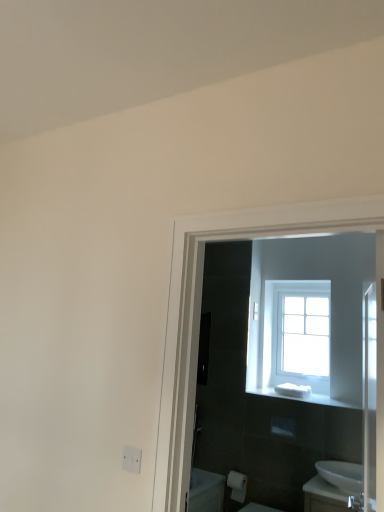
Image resolution: width=384 pixels, height=512 pixels. Describe the element at coordinates (302, 398) in the screenshot. I see `white plastic soap at center` at that location.

Locate an element on the screen. white plastic soap at center is located at coordinates (302, 398).

The width and height of the screenshot is (384, 512). Identify the location of clear glass window at upper center. (297, 334).

Looking at their sizes, would you say white matte electric outlet at lower left is wider or thinner than white plastic soap at center?

white matte electric outlet at lower left is thinner than white plastic soap at center.

Between white matte electric outlet at lower left and white plastic soap at center, which one is positioned behind?

white plastic soap at center is further away from the camera.

Is white matte electric outlet at lower left facing away from white plastic soap at center?

Yes, white matte electric outlet at lower left's orientation is away from white plastic soap at center.

Are white matte electric outlet at lower left and white plastic soap at center beside each other?

No, white matte electric outlet at lower left is not making contact with white plastic soap at center.

Could you tell me if white glossy sink at lower right is facing white plastic soap at center?

No, white glossy sink at lower right is not turned towards white plastic soap at center.

How much distance is there between white glossy sink at lower right and white plastic soap at center?

20.79 inches.

From a real-world perspective, is white glossy sink at lower right over white plastic soap at center?

Actually, white glossy sink at lower right is physically below white plastic soap at center in the real world.

Does white glossy sink at lower right appear on the right side of white plastic soap at center?

Yes, white glossy sink at lower right is to the right of white plastic soap at center.

How many degrees apart are the facing directions of white matte electric outlet at lower left and clear glass window at upper center?

0.937 degrees separate the facing orientations of white matte electric outlet at lower left and clear glass window at upper center.

Is white matte electric outlet at lower left far from clear glass window at upper center?

Yes, white matte electric outlet at lower left and clear glass window at upper center are quite far apart.

Relative to clear glass window at upper center, is white matte electric outlet at lower left in front or behind?

white matte electric outlet at lower left is positioned closer to the viewer than clear glass window at upper center.

Can you confirm if white glossy sink at lower right is smaller than white matte toilet paper at lower center?

No.

Considering the sizes of white glossy sink at lower right and white matte toilet paper at lower center in the image, is white glossy sink at lower right wider or thinner than white matte toilet paper at lower center?

Clearly, white glossy sink at lower right has more width compared to white matte toilet paper at lower center.

From a real-world perspective, does white glossy sink at lower right sit lower than white matte toilet paper at lower center?

No.

Could you tell me if white glossy sink at lower right is facing white matte toilet paper at lower center?

No, white glossy sink at lower right is not aimed at white matte toilet paper at lower center.

Is white matte toilet paper at lower center beside white glossy sink at lower right?

white matte toilet paper at lower center and white glossy sink at lower right are not in contact.

Is white matte toilet paper at lower center to the left of white glossy sink at lower right from the viewer's perspective?

Yes, white matte toilet paper at lower center is to the left of white glossy sink at lower right.

Which object is more forward, white matte toilet paper at lower center or white glossy sink at lower right?

white glossy sink at lower right.

Can you confirm if white matte toilet paper at lower center is thinner than white glossy sink at lower right?

Yes.

Could you tell me if white matte toilet paper at lower center is turned towards white plastic soap at center?

No, white matte toilet paper at lower center is not facing towards white plastic soap at center.

Based on the photo, from the image's perspective, would you say white matte toilet paper at lower center is shown under white plastic soap at center?

Indeed, from the image's perspective, white matte toilet paper at lower center is shown beneath white plastic soap at center.

From a real-world perspective, which is physically above, white matte toilet paper at lower center or white plastic soap at center?

white plastic soap at center, from a real-world perspective.

Considering the sizes of objects white matte toilet paper at lower center and white plastic soap at center in the image provided, who is taller, white matte toilet paper at lower center or white plastic soap at center?

white matte toilet paper at lower center.

Between white plastic soap at center and white matte toilet paper at lower center, which one has smaller width?

Thinner between the two is white matte toilet paper at lower center.

Considering the relative positions of white plastic soap at center and white matte toilet paper at lower center in the image provided, is white plastic soap at center to the left of white matte toilet paper at lower center from the viewer's perspective?

No, white plastic soap at center is not to the left of white matte toilet paper at lower center.

Does point (341, 404) appear closer or farther from the camera than point (235, 482)?

Point (341, 404) is closer to the camera than point (235, 482).

Locate an element on the screen. Image resolution: width=384 pixels, height=512 pixels. balustrade that appears below the white matte electric outlet at lower left (from the image's perspective) is located at coordinates (302, 398).

Image resolution: width=384 pixels, height=512 pixels. Identify the location of sink located underneath the white plastic soap at center (from a real-world perspective). (342, 475).

Considering their positions, is white matte toilet paper at lower center positioned further to white plastic soap at center than white matte electric outlet at lower left?

Among the two, white matte electric outlet at lower left is located further to white plastic soap at center.

When comparing their distances from white matte electric outlet at lower left, does clear glass window at upper center or white matte toilet paper at lower center seem closer?

white matte toilet paper at lower center lies closer to white matte electric outlet at lower left than the other object.

Looking at the image, which one is located further to white matte electric outlet at lower left, clear glass window at upper center or white plastic soap at center?

clear glass window at upper center.

Looking at the image, which one is located further to clear glass window at upper center, white matte toilet paper at lower center or white matte electric outlet at lower left?

white matte electric outlet at lower left is further to clear glass window at upper center.

When comparing their distances from white plastic soap at center, does white matte electric outlet at lower left or white matte toilet paper at lower center seem further?

white matte electric outlet at lower left lies further to white plastic soap at center than the other object.

Consider the image. From the image, which object appears to be farther from white matte electric outlet at lower left, white plastic soap at center or clear glass window at upper center?

clear glass window at upper center is positioned further to the anchor white matte electric outlet at lower left.

Estimate the real-world distances between objects in this image. Which object is further from white glossy sink at lower right, white plastic soap at center or clear glass window at upper center?

clear glass window at upper center is positioned further to the anchor white glossy sink at lower right.

Estimate the real-world distances between objects in this image. Which object is closer to white matte toilet paper at lower center, white glossy sink at lower right or white plastic soap at center?

white plastic soap at center is closer to white matte toilet paper at lower center.

The height and width of the screenshot is (512, 384). What are the coordinates of `toilet paper positioned between white matte electric outlet at lower left and clear glass window at upper center from near to far` in the screenshot? It's located at (237, 485).

Identify the location of balustrade between clear glass window at upper center and white matte toilet paper at lower center in the vertical direction. (302, 398).

This screenshot has width=384, height=512. What are the coordinates of `balustrade between white glossy sink at lower right and clear glass window at upper center from front to back` in the screenshot? It's located at (302, 398).

Where is `sink between white matte electric outlet at lower left and white matte toilet paper at lower center along the z-axis`? This screenshot has height=512, width=384. sink between white matte electric outlet at lower left and white matte toilet paper at lower center along the z-axis is located at coordinates click(x=342, y=475).